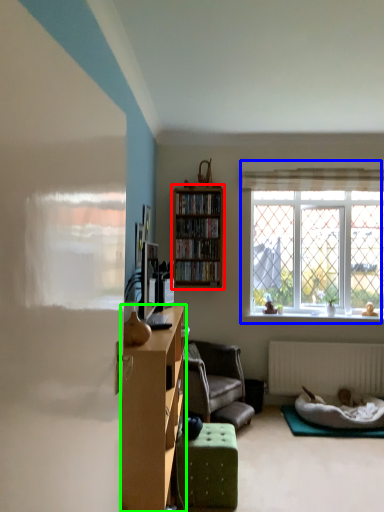
Question: Estimate the real-world distances between objects in this image. Which object is closer to shelf (highlighted by a red box), window (highlighted by a blue box) or cabinetry (highlighted by a green box)?

Choices:
 (A) window
 (B) cabinetry

Answer: (A)